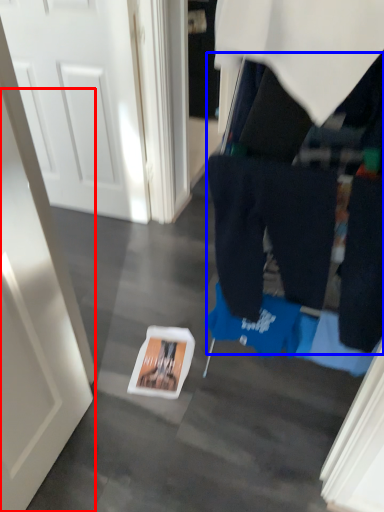
Question: Which object appears farthest to the camera in this image, door (highlighted by a red box) or tight (highlighted by a blue box)?

Choices:
 (A) door
 (B) tight

Answer: (B)